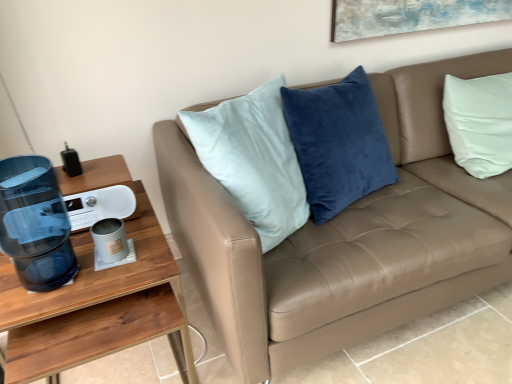
At what (x,y) coordinates should I click in order to perform the action: click on vacant area that lies to the right of matte gray mug at lower left. Please return your answer as a coordinate pair (x, y). Image resolution: width=512 pixels, height=384 pixels. Looking at the image, I should click on (146, 256).